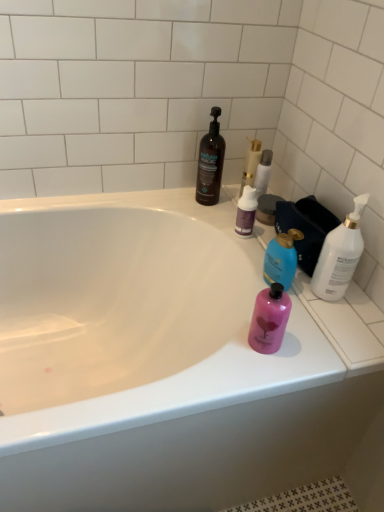
Identify the location of vacant space situated on the left part of white glossy bottle at right, which appears as the 5th bottle when viewed from the left. (291, 281).